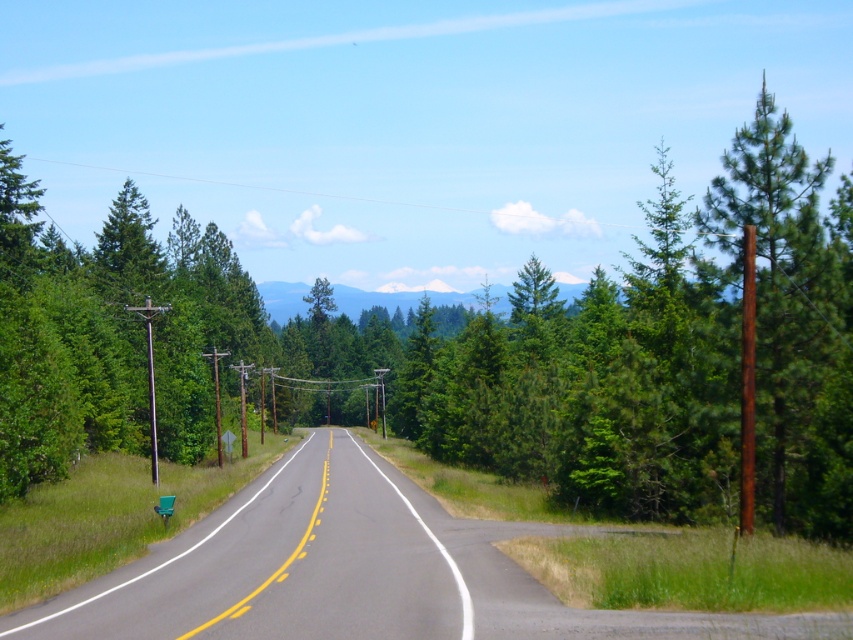
You are a driver approaching the road and see two points marked on the road ahead. The first point is at point (306,452) and the second is at point (776,506). Which point is closer to your current position?

Point (306,452) is closer to your current position because it is further to the viewer than point (776,506), meaning it is nearer to you.

From the picture: You are a driver approaching the asphalt road at center and notice a brown rough pole at right. Which object has a greater height?

The brown rough pole at right has a greater height than the asphalt road at center.

You are a driver approaching the asphalt road at center and see the brown rough pole at right. Which object takes up more space in the image?

The brown rough pole at right occupies more space in the image than the asphalt road at center.